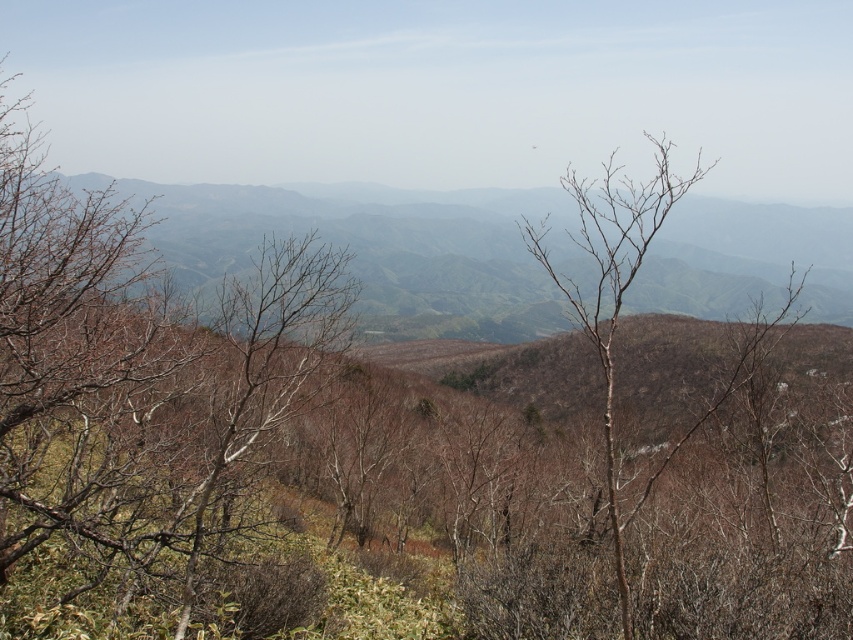
You are standing in the mountainous landscape and want to reach a hidden path behind the trees. Which direction should you move first, towards the brown leafless branches at left or the bare branches at center, to get closer to the hidden path?

You should move towards the bare branches at center first because the brown leafless branches at left is closer to you, so going around them might block your view of the hidden path behind. The bare branches at center are farther away, so moving towards them would allow you to access the area behind the closer branches.

You are standing in the mountainous landscape and want to determine which of the two points, point [317,248] or point [630,241], is closer to you. Based on the scene description, which point is nearer?

Point [317,248] is further to the viewer than point [630,241]. Wait, the answer should be the opposite. Let me check the description again. The Objects Description says that point [317,248] is further to the viewer than point [630,241]. Therefore, the closer point would be the one that is not further, which is point [630,241]. Hmm, but the question asks which is nearer. So the answer should be point [630,241] is closer because the other is further. But the user might have made a mistake in

Consider the image. You are an artist sketching this landscape. You want to emphasize the contrast between the brown leafless branches at left and the bare branches at center. Which of these two has a greater width in the image?

The brown leafless branches at left have a greater width than the bare branches at center.